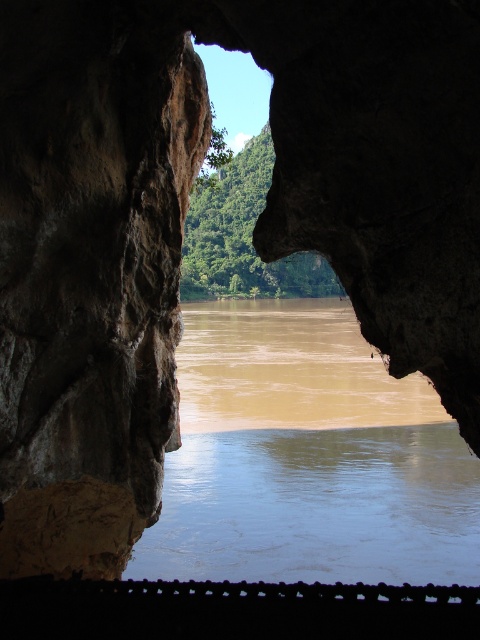
Question: Is rough stone wall at left smaller than brown muddy water at center?

Choices:
 (A) yes
 (B) no

Answer: (A)

Question: Which point appears closest to the camera in this image?

Choices:
 (A) (0, 449)
 (B) (267, 513)

Answer: (A)

Question: Among these objects, which one is farthest from the camera?

Choices:
 (A) brown muddy water at center
 (B) rough stone wall at left

Answer: (A)

Question: Does rough stone wall at left lie in front of brown muddy water at center?

Choices:
 (A) no
 (B) yes

Answer: (B)

Question: Does rough stone wall at left have a lesser width compared to brown muddy water at center?

Choices:
 (A) yes
 (B) no

Answer: (A)